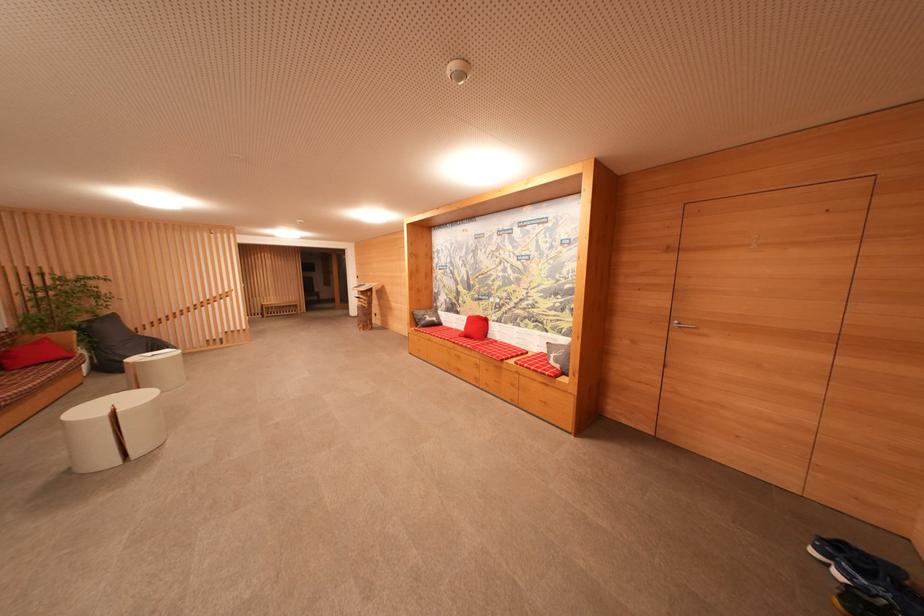
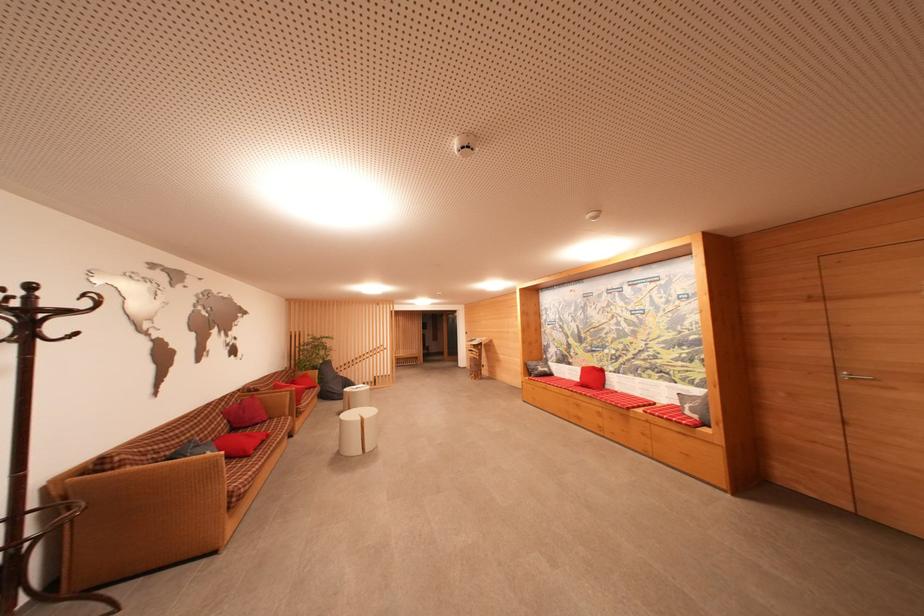
Question: I am providing you with two images of the same scene from different viewpoints. Please identify which objects are invisible in image2.

Choices:
 (A) coat rack hook
 (B) sofa armrest
 (C) grey pillow
 (D) none of these

Answer: (D)